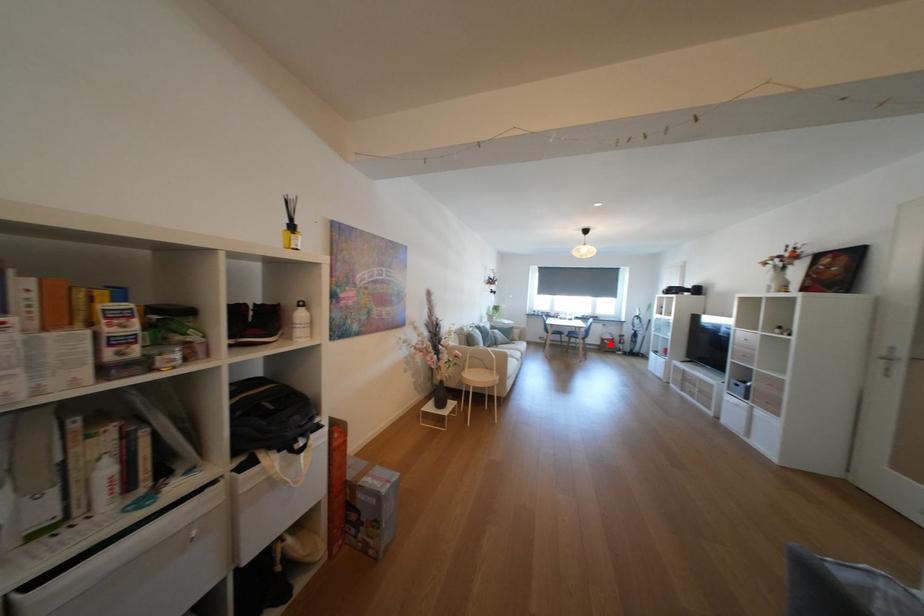
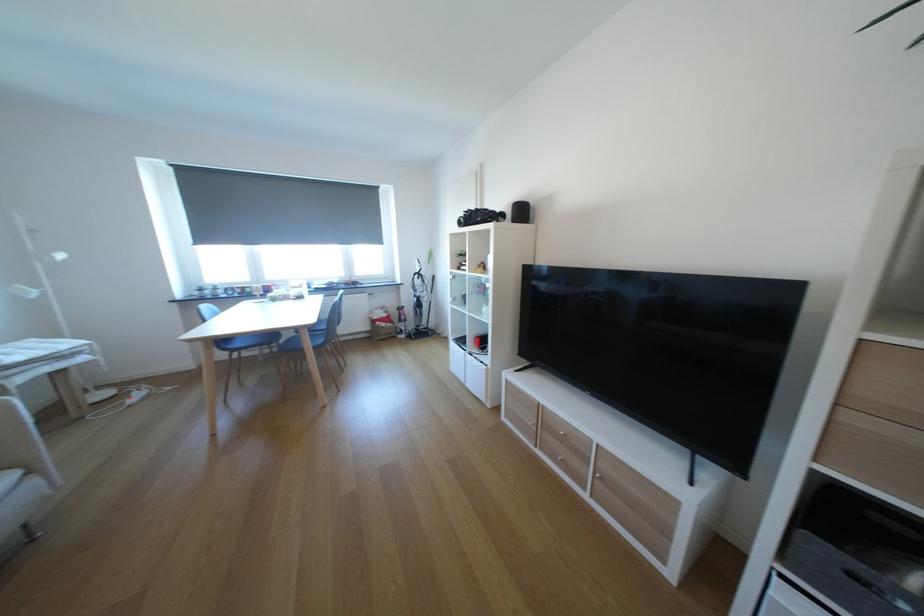
In the second image, find the point that corresponds to the highlighted location in the first image.

(379, 329)